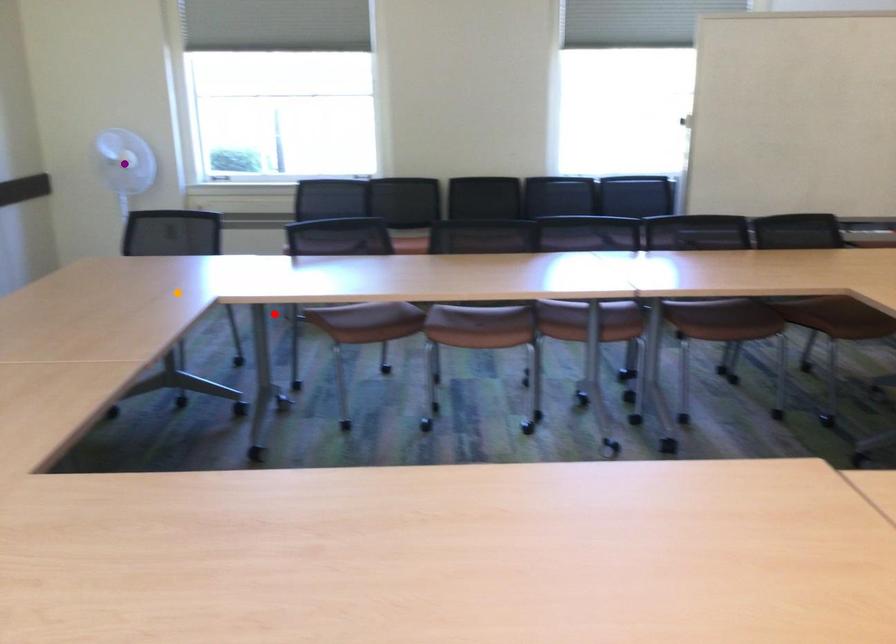
Order these from nearest to farthest:
1. purple point
2. orange point
3. red point

red point
orange point
purple point